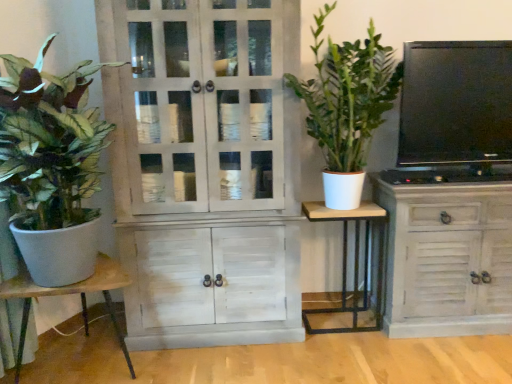
This screenshot has height=384, width=512. In order to click on vacant location below wooden table at left, which is counted as the 2th table, starting from the right (from a real-world perspective) in this screenshot , I will do click(85, 366).